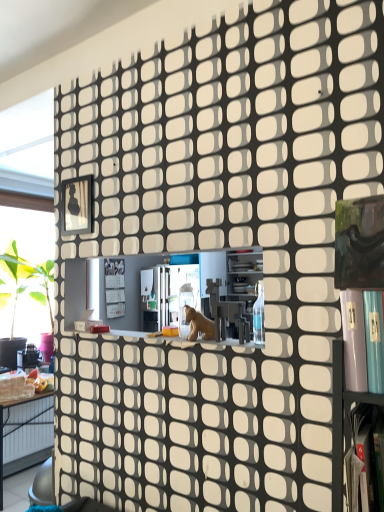
Question: Does metallic silver shelf at lower right appear on the left side of brown matte animal at center?

Choices:
 (A) yes
 (B) no

Answer: (B)

Question: Is brown matte animal at center completely or partially inside metallic silver shelf at lower right?

Choices:
 (A) yes
 (B) no

Answer: (B)

Question: Is metallic silver shelf at lower right looking in the opposite direction of brown matte animal at center?

Choices:
 (A) no
 (B) yes

Answer: (A)

Question: From the image's perspective, is metallic silver shelf at lower right beneath brown matte animal at center?

Choices:
 (A) yes
 (B) no

Answer: (A)

Question: Are metallic silver shelf at lower right and brown matte animal at center located far from each other?

Choices:
 (A) no
 (B) yes

Answer: (A)

Question: From the image's perspective, is brown matte animal at center located above or below metallic frame at upper left?

Choices:
 (A) above
 (B) below

Answer: (B)

Question: Considering the relative positions of brown matte animal at center and metallic frame at upper left in the image provided, is brown matte animal at center to the left or to the right of metallic frame at upper left?

Choices:
 (A) left
 (B) right

Answer: (B)

Question: Is brown matte animal at center wider or thinner than metallic frame at upper left?

Choices:
 (A) wide
 (B) thin

Answer: (A)

Question: From a real-world perspective, is brown matte animal at center positioned above or below metallic frame at upper left?

Choices:
 (A) above
 (B) below

Answer: (B)

Question: Is metallic frame at upper left in front of or behind metallic silver shelf at lower right in the image?

Choices:
 (A) behind
 (B) front

Answer: (A)

Question: Considering the positions of metallic frame at upper left and metallic silver shelf at lower right in the image, is metallic frame at upper left taller or shorter than metallic silver shelf at lower right?

Choices:
 (A) short
 (B) tall

Answer: (A)

Question: In the image, is metallic frame at upper left on the left side or the right side of metallic silver shelf at lower right?

Choices:
 (A) left
 (B) right

Answer: (A)

Question: In terms of size, does metallic frame at upper left appear bigger or smaller than metallic silver shelf at lower right?

Choices:
 (A) big
 (B) small

Answer: (B)

Question: Which is correct: metallic silver shelf at lower right is inside metallic frame at upper left, or outside of it?

Choices:
 (A) inside
 (B) outside

Answer: (B)

Question: Visually, is metallic silver shelf at lower right positioned to the left or to the right of metallic frame at upper left?

Choices:
 (A) right
 (B) left

Answer: (A)